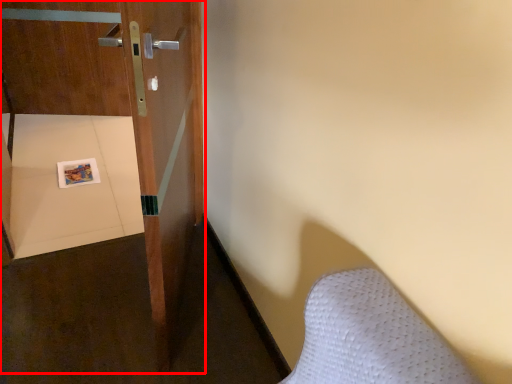
Question: From the image's perspective, where is door (annotated by the red box) located relative to copy?

Choices:
 (A) below
 (B) above

Answer: (B)